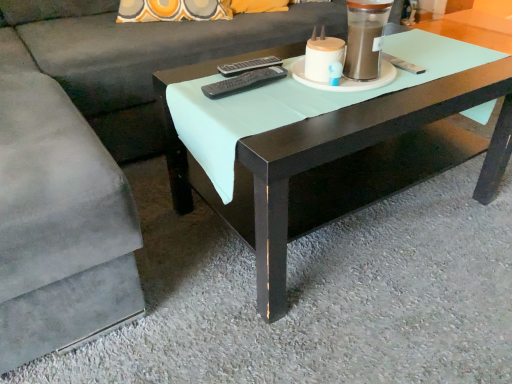
Where is `free region on the left part of black plastic remote at center, the 2th remote viewed from the back`? The height and width of the screenshot is (384, 512). free region on the left part of black plastic remote at center, the 2th remote viewed from the back is located at coordinates (198, 86).